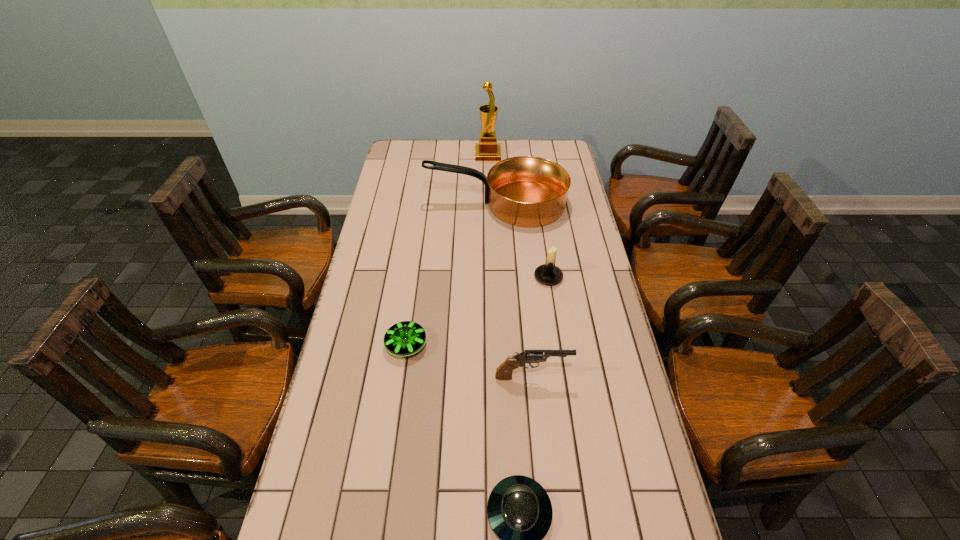
You are a GUI agent. You are given a task and a screenshot of the screen. Output one action in this format:
    pyautogui.click(x=<x>, y=<y>)
    Task: Click on the empty space that is in between the farthest object and the third nearest object
    This screenshot has width=960, height=540.
    Given the screenshot: What is the action you would take?
    pyautogui.click(x=447, y=249)

This screenshot has width=960, height=540. Identify the location of vacant area between the gun and the fifth nearest object. (515, 290).

Locate an element on the screen. This screenshot has width=960, height=540. free space between the farthest object and the left saucer is located at coordinates (447, 249).

The height and width of the screenshot is (540, 960). What are the coordinates of `free spot between the award and the taller saucer` in the screenshot? It's located at (447, 249).

Where is `unoccupied position between the third nearest object and the farthest object`? unoccupied position between the third nearest object and the farthest object is located at coordinates (447, 249).

Select which object is the fourth closest to the second shortest object. Please provide its 2D coordinates. Your answer should be formatted as a tuple, i.e. [(x, y)], where the tuple contains the x and y coordinates of a point satisfying the conditions above.

[(526, 191)]

Find the location of a particular element. object that is the fourth closest one to the second nearest object is located at coordinates (526, 191).